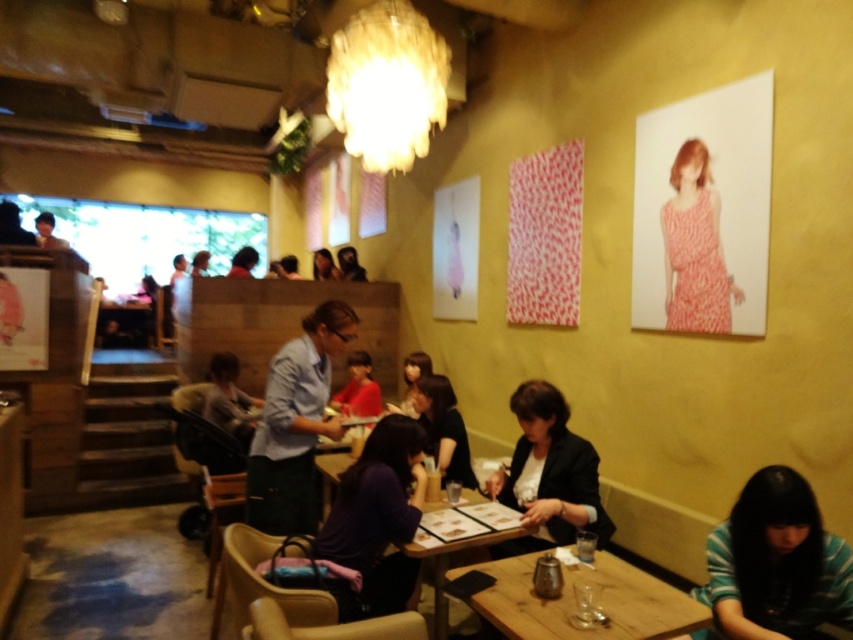
Measure the distance between purple matte shirt at center and matte black hair at center.

purple matte shirt at center and matte black hair at center are 3.92 meters apart.

Measure the distance between point [405,419] and camera.

Point [405,419] is 2.79 meters away from camera.

Is point (363, 579) closer to viewer compared to point (358, 269)?

Yes, it is.

At what (x,y) coordinates should I click in order to perform the action: click on purple matte shirt at center. Please return your answer as a coordinate pair (x, y). The height and width of the screenshot is (640, 853). Looking at the image, I should click on (379, 515).

Is point (717, 548) positioned after point (233, 272)?

That is False.

Which is in front, point (798, 608) or point (241, 253)?

Point (798, 608) is in front.

Is point (751, 547) in front of point (242, 257)?

That is True.

This screenshot has height=640, width=853. Find the location of `striped cotton shirt at lower right`. striped cotton shirt at lower right is located at coordinates (776, 563).

You are a GUI agent. You are given a task and a screenshot of the screen. Output one action in this format:
    pyautogui.click(x=<x>, y=<y>)
    Task: Click on the striped cotton shirt at lower right
    Image resolution: width=853 pixels, height=640 pixels.
    Given the screenshot: What is the action you would take?
    pyautogui.click(x=776, y=563)